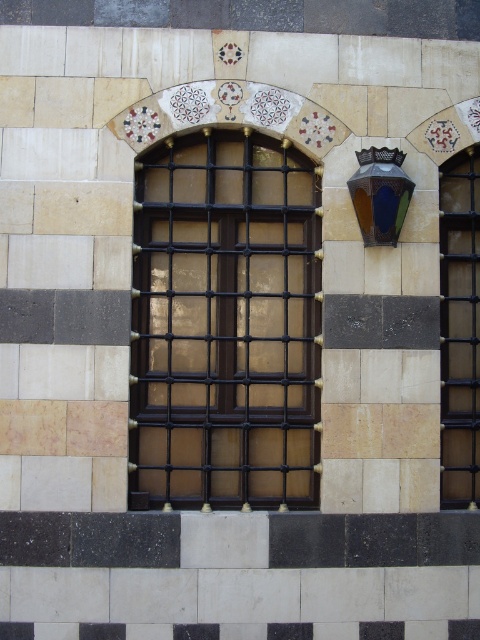
What do you see at coordinates (225, 324) in the screenshot? This screenshot has width=480, height=640. I see `black metal grid at center` at bounding box center [225, 324].

Does point (249, 259) come in front of point (464, 452)?

Yes, it is.

Where is `black metal grid at center`? This screenshot has width=480, height=640. black metal grid at center is located at coordinates (225, 324).